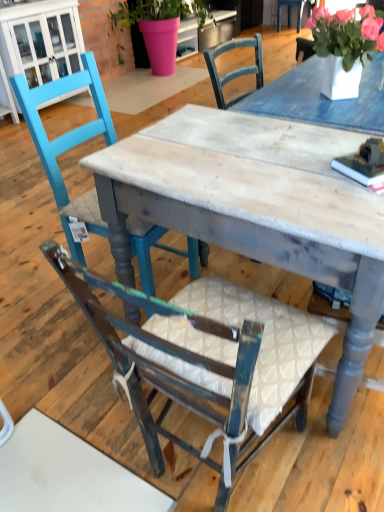
Question: Does teal painted wood chair at left, marked as the 1th chair in a back-to-front arrangement, come behind distressed wood table at center?

Choices:
 (A) no
 (B) yes

Answer: (B)

Question: Considering the relative sizes of teal painted wood chair at left, the 2th chair when ordered from front to back, and distressed wood table at center in the image provided, is teal painted wood chair at left, the 2th chair when ordered from front to back, bigger than distressed wood table at center?

Choices:
 (A) yes
 (B) no

Answer: (B)

Question: Does teal painted wood chair at left, marked as the 1th chair in a back-to-front arrangement, have a lesser height compared to distressed wood table at center?

Choices:
 (A) yes
 (B) no

Answer: (B)

Question: Is teal painted wood chair at left, the 2th chair when ordered from front to back, far away from distressed wood table at center?

Choices:
 (A) no
 (B) yes

Answer: (A)

Question: Is teal painted wood chair at left, marked as the 1th chair in a back-to-front arrangement, to the left of distressed wood table at center from the viewer's perspective?

Choices:
 (A) yes
 (B) no

Answer: (A)

Question: From a real-world perspective, is teal painted wood chair at left, the 2th chair when ordered from front to back, located higher than distressed wood table at center?

Choices:
 (A) no
 (B) yes

Answer: (B)

Question: Can you confirm if wooden chair with white cushion at center, the 1th chair when ordered from front to back, is wider than teal painted wood chair at left, the 2th chair when ordered from front to back?

Choices:
 (A) yes
 (B) no

Answer: (A)

Question: Is wooden chair with white cushion at center, which is the 2th chair from back to front, surrounding teal painted wood chair at left, the 2th chair when ordered from front to back?

Choices:
 (A) yes
 (B) no

Answer: (B)

Question: Is wooden chair with white cushion at center, the 1th chair when ordered from front to back, bigger than teal painted wood chair at left, the 2th chair when ordered from front to back?

Choices:
 (A) yes
 (B) no

Answer: (B)

Question: Considering the relative sizes of wooden chair with white cushion at center, the 1th chair when ordered from front to back, and teal painted wood chair at left, marked as the 1th chair in a back-to-front arrangement, in the image provided, is wooden chair with white cushion at center, the 1th chair when ordered from front to back, shorter than teal painted wood chair at left, marked as the 1th chair in a back-to-front arrangement,?

Choices:
 (A) no
 (B) yes

Answer: (B)

Question: Is the depth of wooden chair with white cushion at center, which is the 2th chair from back to front, greater than that of teal painted wood chair at left, the 2th chair when ordered from front to back?

Choices:
 (A) no
 (B) yes

Answer: (A)

Question: Does wooden chair with white cushion at center, the 1th chair when ordered from front to back, appear on the left side of teal painted wood chair at left, marked as the 1th chair in a back-to-front arrangement?

Choices:
 (A) yes
 (B) no

Answer: (B)

Question: Is teal painted wood chair at left, marked as the 1th chair in a back-to-front arrangement, oriented towards white ceramic vase at upper right?

Choices:
 (A) no
 (B) yes

Answer: (A)